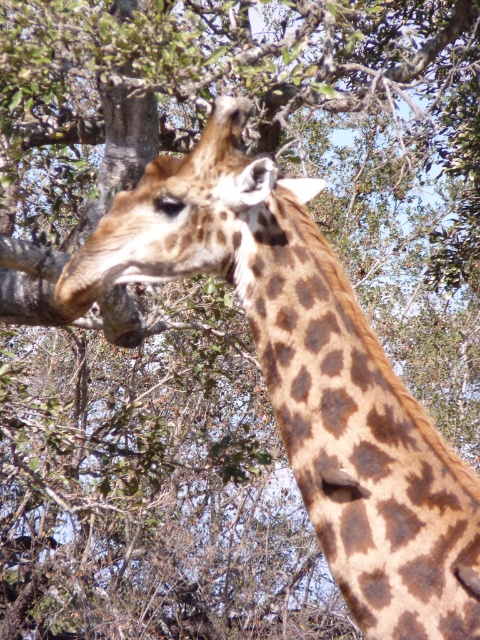
Question: Is spotted fur neck at center further to the viewer compared to spotted fur at center?

Choices:
 (A) yes
 (B) no

Answer: (B)

Question: Does spotted fur neck at center have a lesser width compared to spotted fur at center?

Choices:
 (A) yes
 (B) no

Answer: (A)

Question: Is spotted fur neck at center above spotted fur at center?

Choices:
 (A) no
 (B) yes

Answer: (A)

Question: Which point is farther to the camera?

Choices:
 (A) (284, 301)
 (B) (195, 212)

Answer: (A)